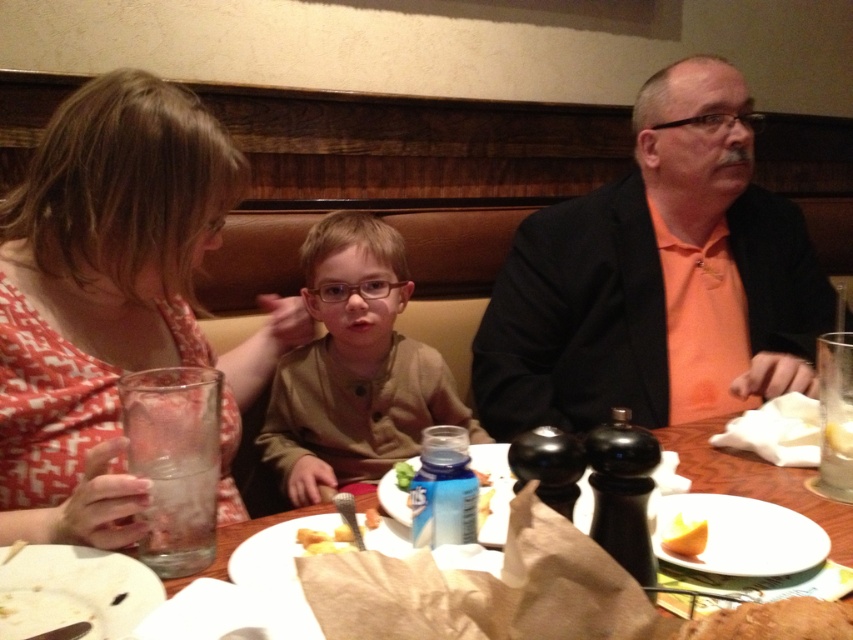
Does yellowish matte bread at center have a lesser width compared to yellow sponge at center?

No.

Looking at this image, who is positioned more to the right, yellowish matte bread at center or yellow sponge at center?

yellow sponge at center

Who is more forward, [306,540] or [846,424]?

Positioned in front is point [306,540].

Locate an element on the screen. The width and height of the screenshot is (853, 640). yellowish matte bread at center is located at coordinates (335, 534).

Can you confirm if matte red dress at left is bigger than brown matte shirt at center?

Correct, matte red dress at left is larger in size than brown matte shirt at center.

Can you confirm if matte red dress at left is shorter than brown matte shirt at center?

Incorrect, matte red dress at left's height does not fall short of brown matte shirt at center's.

Between point (202, 173) and point (314, 392), which one is positioned behind?

Positioned behind is point (314, 392).

You are a GUI agent. You are given a task and a screenshot of the screen. Output one action in this format:
    pyautogui.click(x=<x>, y=<y>)
    Task: Click on the matte red dress at left
    The image size is (853, 640).
    Given the screenshot: What is the action you would take?
    pyautogui.click(x=113, y=301)

Is matte red dress at left to the right of orange matte jacket at upper right from the viewer's perspective?

No, matte red dress at left is not to the right of orange matte jacket at upper right.

Between matte red dress at left and orange matte jacket at upper right, which one is positioned lower?

matte red dress at left

Which is in front, point (140, 298) or point (637, 205)?

Point (140, 298) is in front.

In order to click on matte red dress at left in this screenshot , I will do `click(113, 301)`.